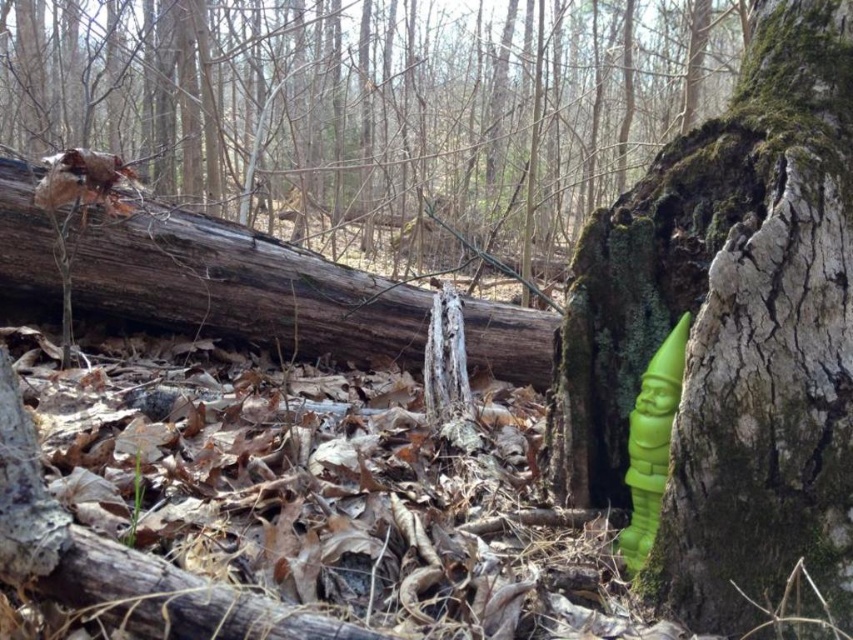
You are a hiker who wants to place a small item between the green plastic gnome at right and the green matte gnome at center. Which gnome has a larger width that could block the placement of the item?

The green plastic gnome at right might be wider than the green matte gnome at center, so placing an item between them may be more challenging due to its greater width.